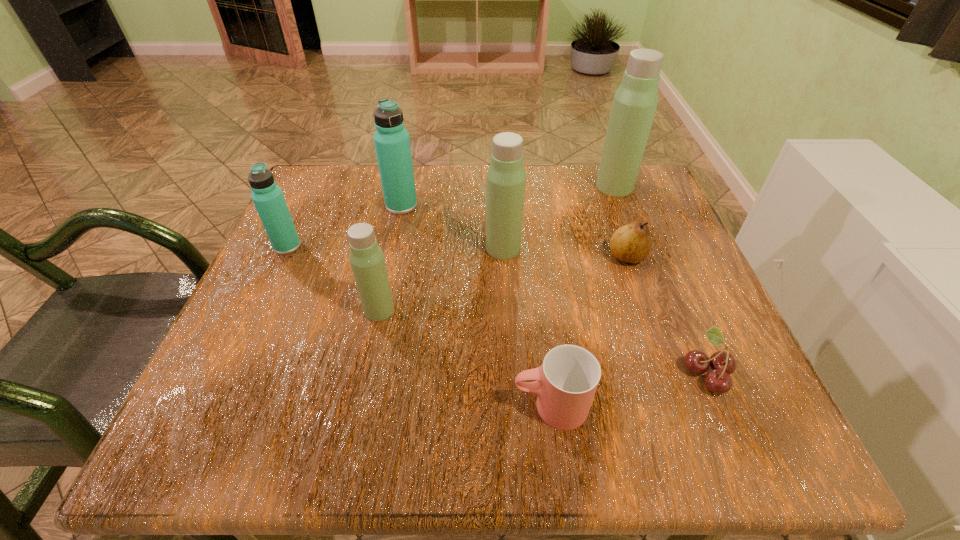
This screenshot has height=540, width=960. In order to click on pear in this screenshot , I will do `click(631, 243)`.

Identify the location of cup. This screenshot has height=540, width=960. (565, 384).

Find the location of `the shortest object`. the shortest object is located at coordinates (718, 380).

At what (x,y) coordinates should I click in order to perform the action: click on red cherry. Please return your answer as a coordinate pair (x, y). This screenshot has width=960, height=540. Looking at the image, I should click on (718, 380).

Locate an element on the screen. The height and width of the screenshot is (540, 960). vacant area situated on the right of the tallest object is located at coordinates (654, 186).

Locate an element on the screen. The image size is (960, 540). blank space located on the back of the farther aqua thermos bottle is located at coordinates (406, 182).

At what (x,y) coordinates should I click in order to perform the action: click on vacant space located 0.360m on the left of the second light thermos bottle from right to left. Please return your answer as a coordinate pair (x, y). Looking at the image, I should click on (307, 248).

Identify the location of free space located 0.240m on the right of the nearer aqua thermos bottle. (419, 246).

This screenshot has width=960, height=540. In order to click on vacant area situated 0.160m on the right of the nearest light thermos bottle in this screenshot , I will do `click(485, 310)`.

This screenshot has width=960, height=540. I want to click on vacant position located 0.080m on the front of the pear, so click(642, 300).